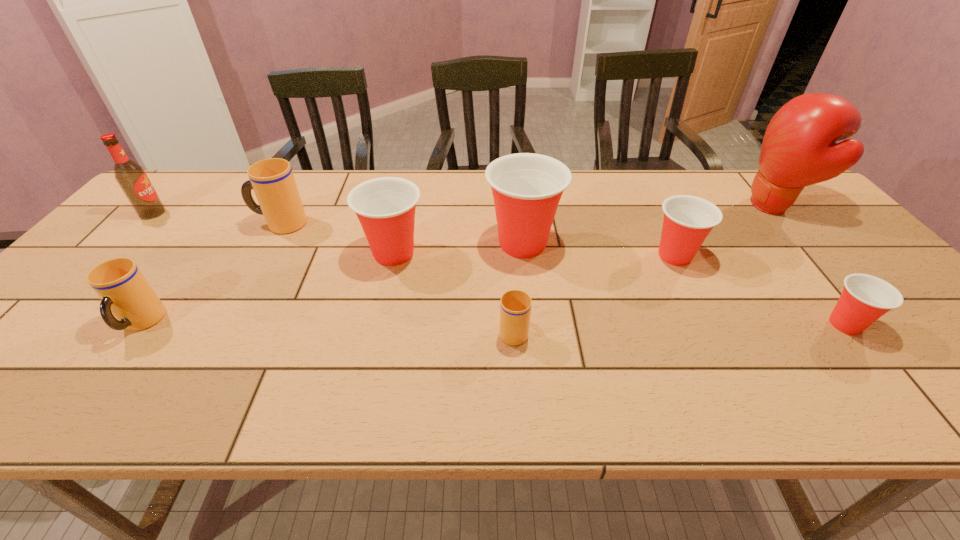
Where is `blank area located on the right of the third red cup from right to left`? blank area located on the right of the third red cup from right to left is located at coordinates (616, 244).

Identify the location of free space located on the side of the farthest beige cup with the handle. Image resolution: width=960 pixels, height=540 pixels. (232, 224).

Where is `vacant space positioned on the side of the farthest beige cup with the handle`? This screenshot has height=540, width=960. vacant space positioned on the side of the farthest beige cup with the handle is located at coordinates (208, 224).

The image size is (960, 540). What are the coordinates of `vacant area situated on the side of the farthest beige cup with the handle` in the screenshot? It's located at (149, 224).

You are a GUI agent. You are given a task and a screenshot of the screen. Output one action in this format:
    pyautogui.click(x=<x>, y=<y>)
    Task: Click on the free region located on the right of the second biggest red cup
    This screenshot has height=540, width=960.
    Given the screenshot: What is the action you would take?
    pyautogui.click(x=516, y=253)

Find the location of a particular element. The image size is (960, 540). vacant space located 0.110m on the back of the second cup from right to left is located at coordinates (656, 216).

The image size is (960, 540). I want to click on free space located on the side of the leftmost beige cup with the handle, so click(x=79, y=408).

You are a GUI agent. You are given a task and a screenshot of the screen. Output one action in this format:
    pyautogui.click(x=<x>, y=<y>)
    Task: Click on the vacant area situated on the left of the rightmost cup
    
    Given the screenshot: What is the action you would take?
    pyautogui.click(x=658, y=325)

The image size is (960, 540). Identify the location of free region located on the side of the rightmost beige cup with the handle. (509, 271).

At what (x,y) coordinates should I click in order to perform the action: click on free point located on the side of the rightmost beige cup with the handle. Please return your answer as a coordinate pair (x, y). This screenshot has height=540, width=960. Looking at the image, I should click on (510, 285).